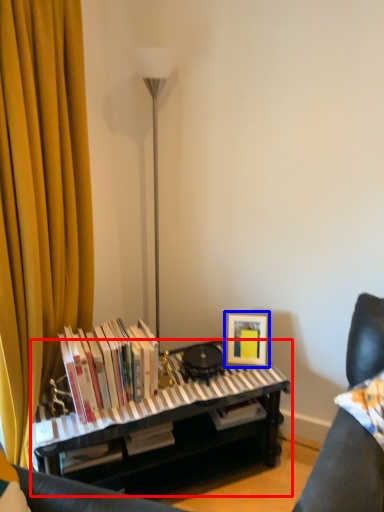
Question: Which object is further to the camera taking this photo, piano (highlighted by a red box) or picture frame (highlighted by a blue box)?

Choices:
 (A) piano
 (B) picture frame

Answer: (B)